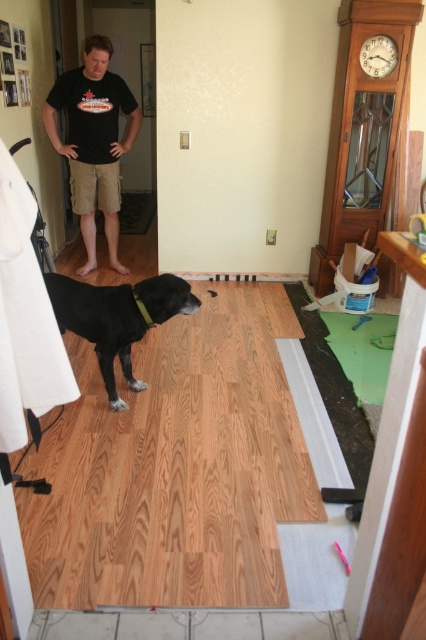
Question: Is matte black t-shirt at center bigger than black matte dog at center?

Choices:
 (A) no
 (B) yes

Answer: (B)

Question: Which object appears closest to the camera in this image?

Choices:
 (A) matte black t-shirt at center
 (B) black matte dog at center
 (C) brown wood flooring at center

Answer: (C)

Question: Does brown wood flooring at center appear over matte black t-shirt at center?

Choices:
 (A) yes
 (B) no

Answer: (B)

Question: Is brown wood flooring at center thinner than black matte dog at center?

Choices:
 (A) no
 (B) yes

Answer: (A)

Question: Which of these objects is positioned closest to the brown wood flooring at center?

Choices:
 (A) black matte dog at center
 (B) matte black t-shirt at center

Answer: (A)

Question: Which point is farther to the camera?

Choices:
 (A) black matte dog at center
 (B) matte black t-shirt at center
 (C) brown wood flooring at center

Answer: (B)